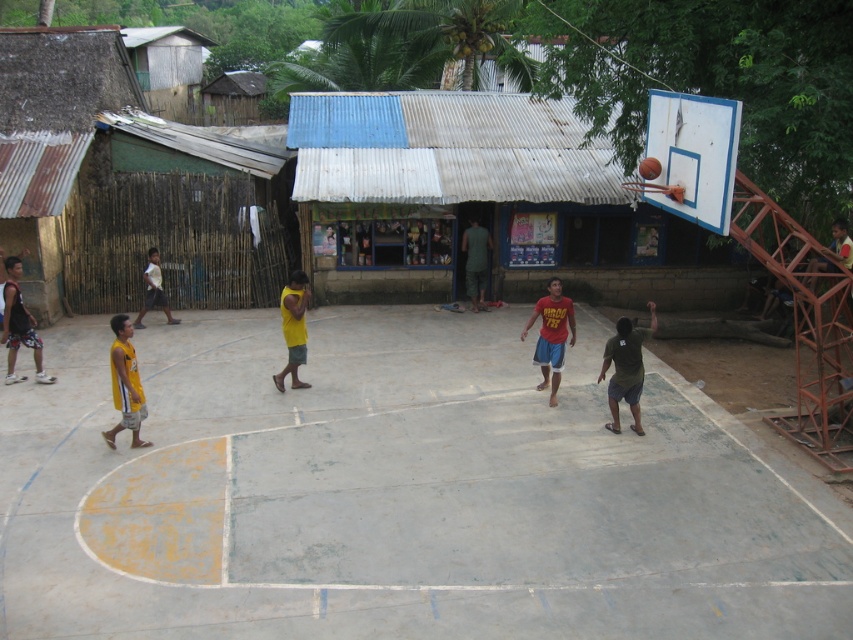
Question: Is green fabric shirt at center in front of shiny metallic basketball at center?

Choices:
 (A) yes
 (B) no

Answer: (B)

Question: Is yellow matte shorts at center wider than yellow fabric shirt at left?

Choices:
 (A) yes
 (B) no

Answer: (B)

Question: Does matte black shorts at left appear over yellow matte shorts at center?

Choices:
 (A) no
 (B) yes

Answer: (B)

Question: Which object appears closest to the camera in this image?

Choices:
 (A) matte black shorts at left
 (B) white corrugated metal hut at center
 (C) green fabric shirt at center
 (D) yellow matte shorts at center

Answer: (B)

Question: Which object is the farthest from the blue painted metal basketball hoop at upper right?

Choices:
 (A) matte black shorts at left
 (B) red matte basketball player at center
 (C) white corrugated metal hut at center
 (D) yellow matte shorts at center

Answer: (A)

Question: Among these points, which one is nearest to the camera?

Choices:
 (A) (485, 244)
 (B) (526, 323)
 (C) (732, 152)

Answer: (C)